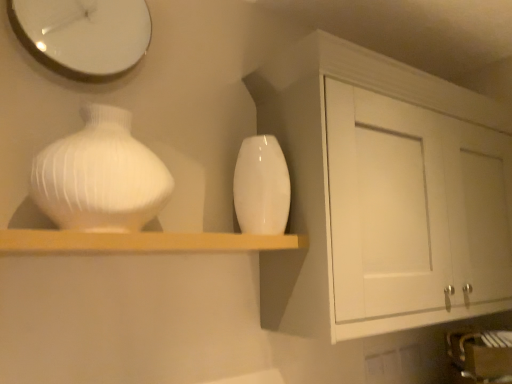
This screenshot has width=512, height=384. I want to click on white matte cabinet at upper right, so click(380, 193).

Locate an element on the screen. This screenshot has width=512, height=384. wooden shelf at center is located at coordinates (140, 242).

Where is `white matte cabinet at upper right`? This screenshot has height=384, width=512. white matte cabinet at upper right is located at coordinates (380, 193).

Is white glossy clock at upper left bigger than glossy ceramic vase at center, the second vase when ordered from left to right?

No.

Is white glossy clock at upper left positioned far away from glossy ceramic vase at center, the second vase positioned from the front?

They are positioned close to each other.

From a real-world perspective, between white glossy clock at upper left and glossy ceramic vase at center, the second vase when ordered from left to right, who is vertically higher?

white glossy clock at upper left is physically above.

Could you tell me if wooden shelf at center is turned towards white glossy vase at left, the 1th vase from the front?

No.

Measure the distance from wooden shelf at center to white glossy vase at left, the 1th vase from the front.

wooden shelf at center is 5.81 inches from white glossy vase at left, the 1th vase from the front.

From the image's perspective, is wooden shelf at center under white glossy vase at left, arranged as the 2th vase when viewed from the back?

Yes, from the image's perspective, wooden shelf at center is below white glossy vase at left, arranged as the 2th vase when viewed from the back.

From a real-world perspective, who is located lower, wooden shelf at center or white glossy vase at left, the 1th vase from the front?

wooden shelf at center is physically lower.

Considering the sizes of white glossy clock at upper left and white glossy vase at left, the 1th vase from the front, in the image, is white glossy clock at upper left taller or shorter than white glossy vase at left, the 1th vase from the front,?

white glossy clock at upper left is taller than white glossy vase at left, the 1th vase from the front.

Considering their positions, is white glossy clock at upper left located in front of or behind white glossy vase at left, arranged as the 2th vase when viewed from the back?

white glossy clock at upper left is behind white glossy vase at left, arranged as the 2th vase when viewed from the back.

Which is correct: white glossy clock at upper left is inside white glossy vase at left, acting as the 2th vase starting from the right, or outside of it?

white glossy clock at upper left lies outside white glossy vase at left, acting as the 2th vase starting from the right.

From a real-world perspective, is white glossy clock at upper left physically below wooden shelf at center?

Actually, white glossy clock at upper left is physically above wooden shelf at center in the real world.

Who is taller, white glossy clock at upper left or wooden shelf at center?

With more height is white glossy clock at upper left.

Between white glossy clock at upper left and wooden shelf at center, which one is positioned behind?

white glossy clock at upper left is more distant.

Identify the location of cabinetry behind the white glossy clock at upper left. Image resolution: width=512 pixels, height=384 pixels. (380, 193).

From a real-world perspective, is white glossy clock at upper left positioned under white matte cabinet at upper right based on gravity?

Incorrect, from a real-world perspective, white glossy clock at upper left is higher than white matte cabinet at upper right.

Is white glossy clock at upper left oriented away from white matte cabinet at upper right?

white glossy clock at upper left does not have its back to white matte cabinet at upper right.

Is white glossy clock at upper left located within glossy ceramic vase at center, which ranks as the 1th vase in right-to-left order?

No, white glossy clock at upper left is not surrounded by glossy ceramic vase at center, which ranks as the 1th vase in right-to-left order.

Does glossy ceramic vase at center, the second vase positioned from the front, have a greater height compared to white glossy clock at upper left?

No, glossy ceramic vase at center, the second vase positioned from the front, is not taller than white glossy clock at upper left.

Does point (264, 152) come closer to viewer compared to point (112, 42)?

No.

Could you tell me if glossy ceramic vase at center, the second vase when ordered from left to right, is turned towards white glossy clock at upper left?

No.

Considering the relative sizes of wooden shelf at center and glossy ceramic vase at center, the second vase positioned from the front, in the image provided, is wooden shelf at center taller than glossy ceramic vase at center, the second vase positioned from the front,?

In fact, wooden shelf at center may be shorter than glossy ceramic vase at center, the second vase positioned from the front.

From the image's perspective, is wooden shelf at center located above or below glossy ceramic vase at center, the second vase when ordered from left to right?

wooden shelf at center is situated lower than glossy ceramic vase at center, the second vase when ordered from left to right, in the image.

Is wooden shelf at center placed right next to glossy ceramic vase at center, which ranks as the 1th vase in right-to-left order?

No, wooden shelf at center is not next to glossy ceramic vase at center, which ranks as the 1th vase in right-to-left order.

This screenshot has height=384, width=512. I want to click on clock above the glossy ceramic vase at center, which ranks as the 1th vase in right-to-left order (from the image's perspective), so click(x=83, y=35).

Locate an element on the screen. The width and height of the screenshot is (512, 384). the 1st vase behind the wooden shelf at center, counting from the anchor's position is located at coordinates (100, 176).

Based on their spatial positions, is white glossy clock at upper left or glossy ceramic vase at center, positioned as the first vase in back-to-front order, further from white glossy vase at left, the 1th vase from the front?

Based on the image, glossy ceramic vase at center, positioned as the first vase in back-to-front order, appears to be further to white glossy vase at left, the 1th vase from the front.

Looking at this image, which object lies nearer to the anchor point white glossy clock at upper left, white matte cabinet at upper right or white glossy vase at left, acting as the 2th vase starting from the right?

Among the two, white glossy vase at left, acting as the 2th vase starting from the right, is located nearer to white glossy clock at upper left.

Estimate the real-world distances between objects in this image. Which object is closer to white glossy vase at left, arranged as the 2th vase when viewed from the back, white glossy clock at upper left or white matte cabinet at upper right?

Among the two, white glossy clock at upper left is located nearer to white glossy vase at left, arranged as the 2th vase when viewed from the back.

Considering their positions, is white glossy clock at upper left positioned further to wooden shelf at center than white glossy vase at left, acting as the first vase starting from the left?

white glossy clock at upper left is positioned further to the anchor wooden shelf at center.

From the image, which object appears to be farther from glossy ceramic vase at center, the second vase positioned from the front, wooden shelf at center or white glossy vase at left, acting as the first vase starting from the left?

white glossy vase at left, acting as the first vase starting from the left, is positioned further to the anchor glossy ceramic vase at center, the second vase positioned from the front.

Looking at the image, which one is located closer to white matte cabinet at upper right, white glossy clock at upper left or wooden shelf at center?

wooden shelf at center is positioned closer to the anchor white matte cabinet at upper right.

Considering their positions, is wooden shelf at center positioned further to white matte cabinet at upper right than glossy ceramic vase at center, which ranks as the 1th vase in right-to-left order?

The object further to white matte cabinet at upper right is wooden shelf at center.

Looking at this image, looking at the image, which one is located further to white glossy vase at left, arranged as the 2th vase when viewed from the back, white matte cabinet at upper right or wooden shelf at center?

white matte cabinet at upper right is positioned further to the anchor white glossy vase at left, arranged as the 2th vase when viewed from the back.

Locate an element on the screen. Image resolution: width=512 pixels, height=384 pixels. vase situated between wooden shelf at center and white matte cabinet at upper right from left to right is located at coordinates (261, 186).

Identify the location of shelf situated between white glossy clock at upper left and white matte cabinet at upper right from left to right. (140, 242).

The width and height of the screenshot is (512, 384). In order to click on vase between wooden shelf at center and glossy ceramic vase at center, the second vase when ordered from left to right, along the z-axis in this screenshot , I will do point(100,176).

Locate an element on the screen. vase between white glossy clock at upper left and glossy ceramic vase at center, positioned as the first vase in back-to-front order, in the horizontal direction is located at coordinates (100, 176).